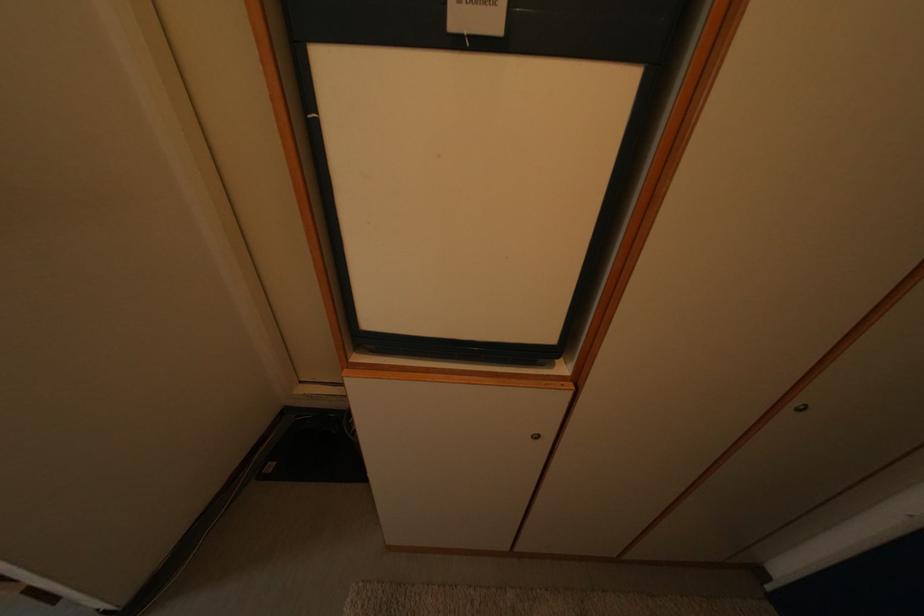
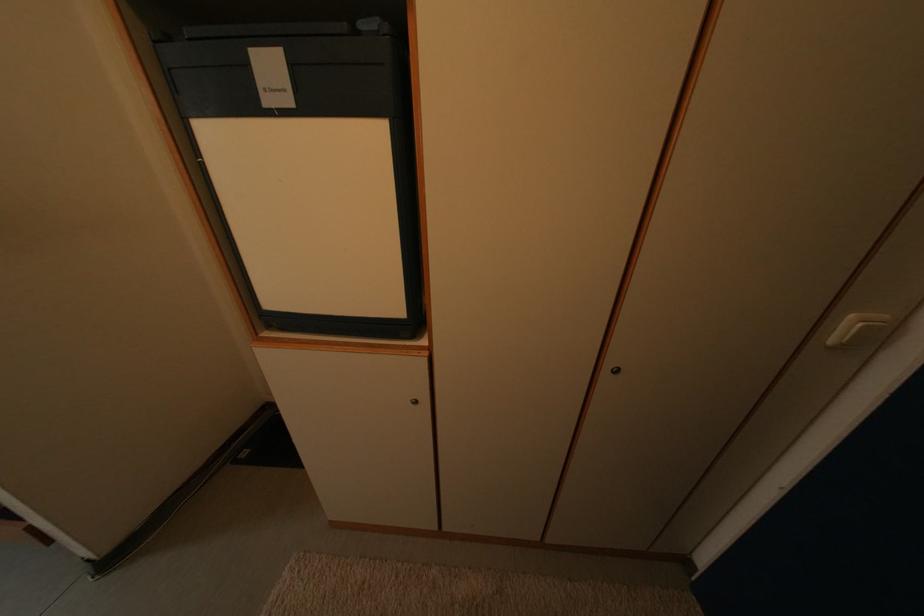
Question: The images are taken continuously from a first-person perspective. In which direction are you moving?

Choices:
 (A) Left
 (B) Right
 (C) Forward
 (D) Backward

Answer: (B)